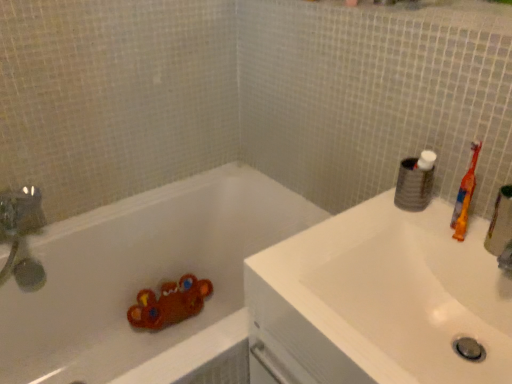
You are a GUI agent. You are given a task and a screenshot of the screen. Output one action in this format:
    pyautogui.click(x=<x>, y=<y>)
    Task: Click on the vacant space in front of white matte toilet paper at upper right
    
    Given the screenshot: What is the action you would take?
    pyautogui.click(x=431, y=231)